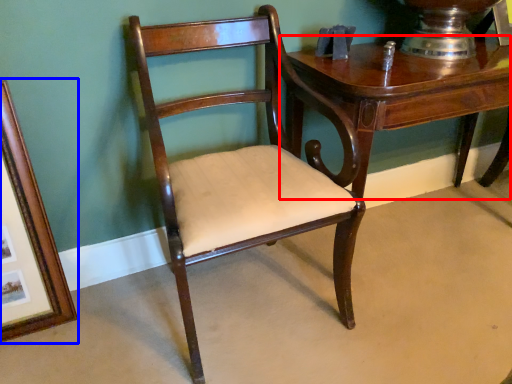
Question: Which object appears farthest to the camera in this image, table (highlighted by a red box) or picture frame (highlighted by a blue box)?

Choices:
 (A) table
 (B) picture frame

Answer: (A)